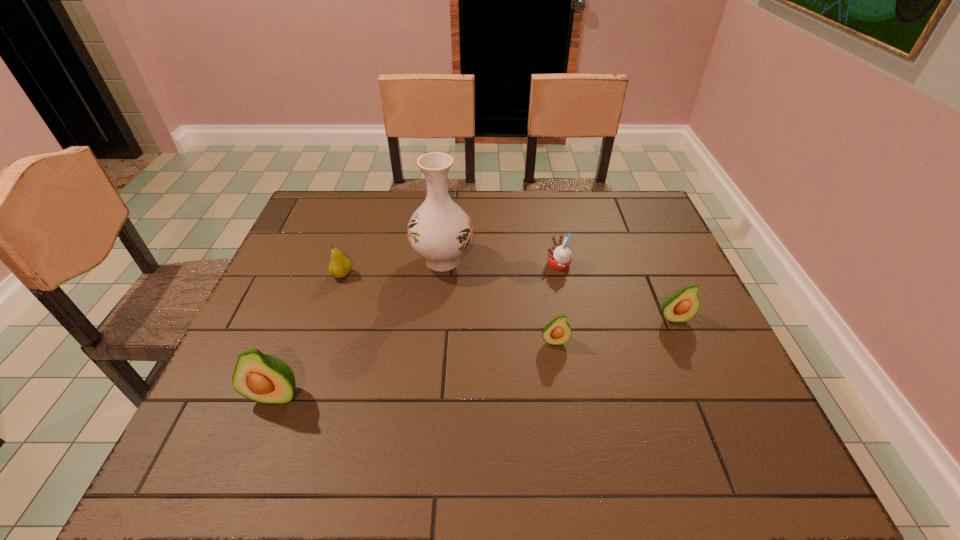
Find the location of `the third closest avocado to the muffin`. the third closest avocado to the muffin is located at coordinates (264, 378).

Where is `avocado that is the second closest to the nearest avocado`? This screenshot has width=960, height=540. avocado that is the second closest to the nearest avocado is located at coordinates (681, 306).

Where is `vacant region that satisfies the following two spatial constraints: 1. on the front-facing side of the muffin; 2. on the cut side of the leftmost avocado`? This screenshot has width=960, height=540. vacant region that satisfies the following two spatial constraints: 1. on the front-facing side of the muffin; 2. on the cut side of the leftmost avocado is located at coordinates (585, 395).